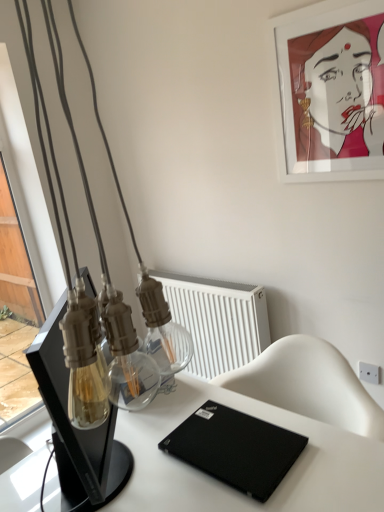
Question: From a real-world perspective, is white matte picture frame at upper right beneath clear glass bottle at center?

Choices:
 (A) no
 (B) yes

Answer: (A)

Question: Is the position of white matte picture frame at upper right less distant than that of clear glass bottle at center?

Choices:
 (A) no
 (B) yes

Answer: (A)

Question: Can clear glass bottle at center be found inside white matte picture frame at upper right?

Choices:
 (A) no
 (B) yes

Answer: (A)

Question: Is white matte picture frame at upper right shorter than clear glass bottle at center?

Choices:
 (A) yes
 (B) no

Answer: (B)

Question: Does white matte picture frame at upper right lie behind clear glass bottle at center?

Choices:
 (A) yes
 (B) no

Answer: (A)

Question: From the image's perspective, is white matte picture frame at upper right located beneath clear glass bottle at center?

Choices:
 (A) no
 (B) yes

Answer: (A)

Question: Would you say black matte laptop at lower right is part of white plastic electric outlet at upper right's contents?

Choices:
 (A) no
 (B) yes

Answer: (A)

Question: Are white plastic electric outlet at upper right and black matte laptop at lower right located far from each other?

Choices:
 (A) no
 (B) yes

Answer: (A)

Question: Considering the relative positions of white plastic electric outlet at upper right and black matte laptop at lower right in the image provided, is white plastic electric outlet at upper right to the left of black matte laptop at lower right from the viewer's perspective?

Choices:
 (A) yes
 (B) no

Answer: (B)

Question: From a real-world perspective, does white plastic electric outlet at upper right sit lower than black matte laptop at lower right?

Choices:
 (A) no
 (B) yes

Answer: (B)

Question: Is white plastic electric outlet at upper right completely or partially outside of black matte laptop at lower right?

Choices:
 (A) no
 (B) yes

Answer: (B)

Question: Does white plastic electric outlet at upper right have a smaller size compared to black matte laptop at lower right?

Choices:
 (A) yes
 (B) no

Answer: (A)

Question: Can you confirm if black matte laptop at center is taller than clear glass bottle at center?

Choices:
 (A) yes
 (B) no

Answer: (A)